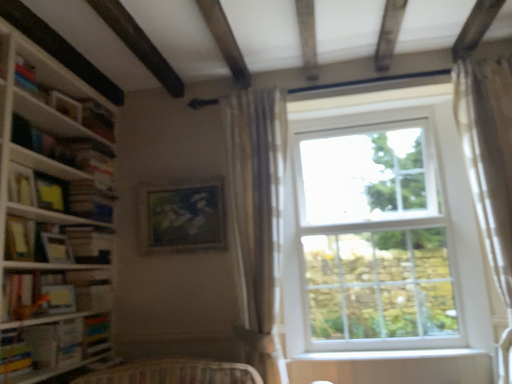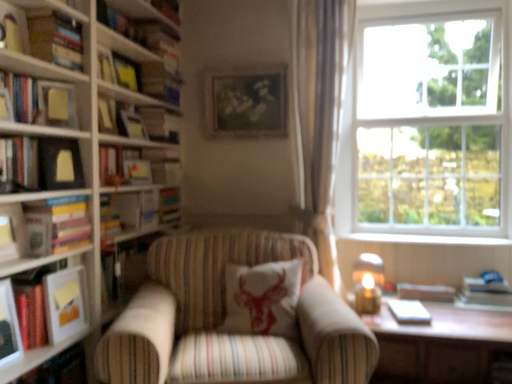
Question: Which way did the camera rotate in the video?

Choices:
 (A) rotated upward
 (B) rotated downward

Answer: (B)